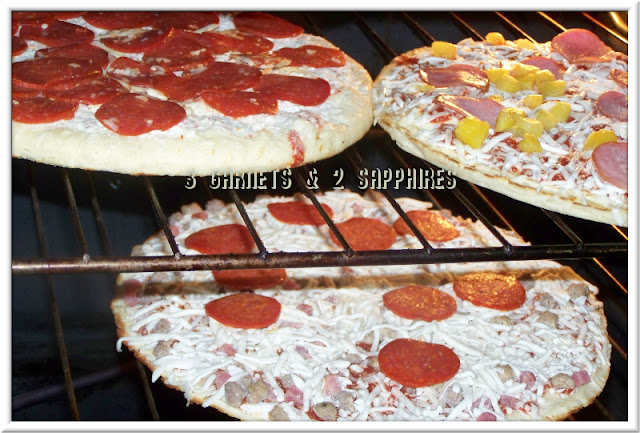
Where is `oven light is above here`? oven light is above here is located at coordinates (621, 25).